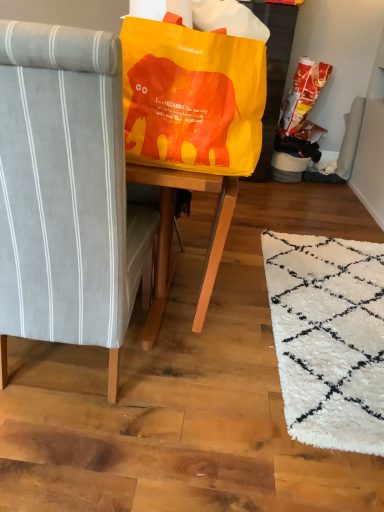
Question: Looking at their shapes, would you say matte yellow bean bag chair at upper center is wider or thinner than matte orange plastic bag at upper right?

Choices:
 (A) wide
 (B) thin

Answer: (A)

Question: From a real-world perspective, is matte yellow bean bag chair at upper center above or below matte orange plastic bag at upper right?

Choices:
 (A) below
 (B) above

Answer: (B)

Question: Estimate the real-world distances between objects in this image. Which object is farther from the matte orange plastic bag at upper right?

Choices:
 (A) matte yellow bean bag chair at upper center
 (B) gray fabric chair at left

Answer: (B)

Question: Which object is positioned closest to the gray fabric chair at left?

Choices:
 (A) matte yellow bean bag chair at upper center
 (B) matte orange plastic bag at upper right

Answer: (A)